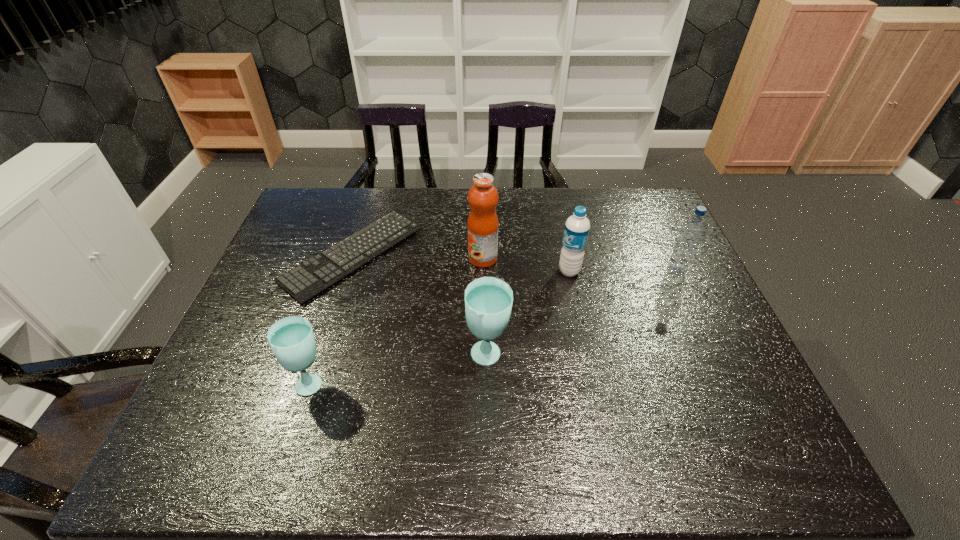
Please show where to add a glass on the right while keeping spacing even. Please provide its 2D coordinates. Your answer should be formatted as a tuple, i.e. [(x, y)], where the tuple contains the x and y coordinates of a point satisfying the conditions above.

[(648, 334)]